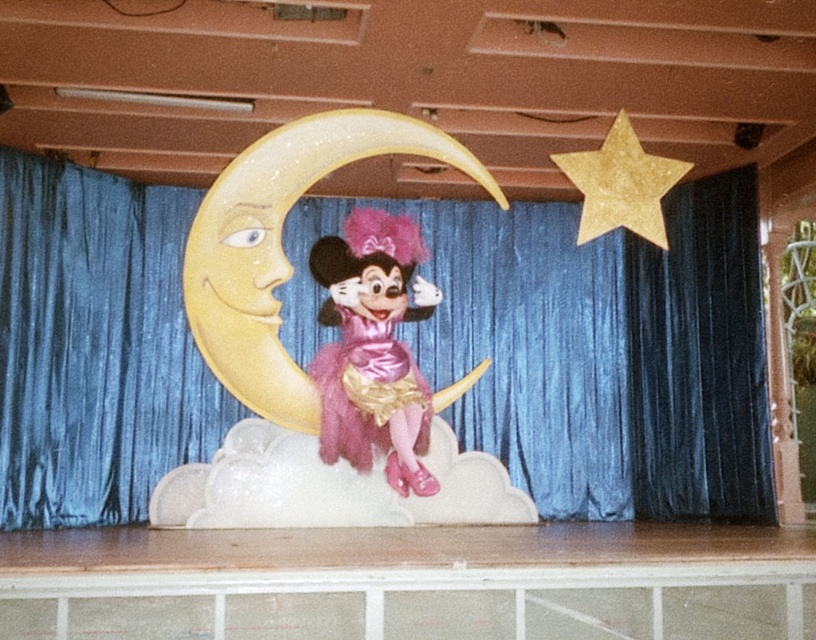
You are an event planner setting up a Disney themed stage. You have a golden star prop that needs to be placed on the wooden stage at center. The stage is represented by the point at coordinates point (420, 577). Where should you place the golden star prop relative to the wooden stage at center?

The golden star prop should be placed above the wooden stage at center because the large, golden star is positioned above the character who is sitting on the crescent moon prop located at the wooden stage at center.

You are an event planner setting up a Disney theme party. You need to place a large golden star above the velvet blue curtain at center. Based on the coordinates given, where should you place the star?

The velvet blue curtain at center is located at coordinates point (608, 353). To place the large golden star above it, you should position the star at a point with a higher y value than 0.746 while maintaining the same x coordinate of 0.552, ensuring it is directly above the curtain.

You are an event planner setting up a Disney themed birthday party. You have a wooden stage at center and a gold glitter star at upper right. Which object is wider?

The wooden stage at center is wider than the gold glitter star at upper right according to the description.